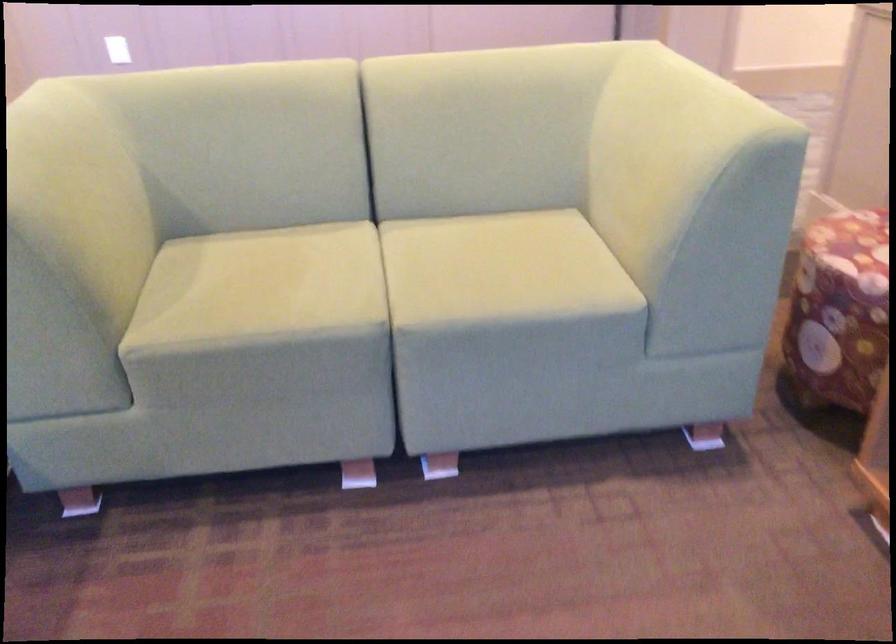
Describe the element at coordinates (851, 231) in the screenshot. I see `a patterned stool` at that location.